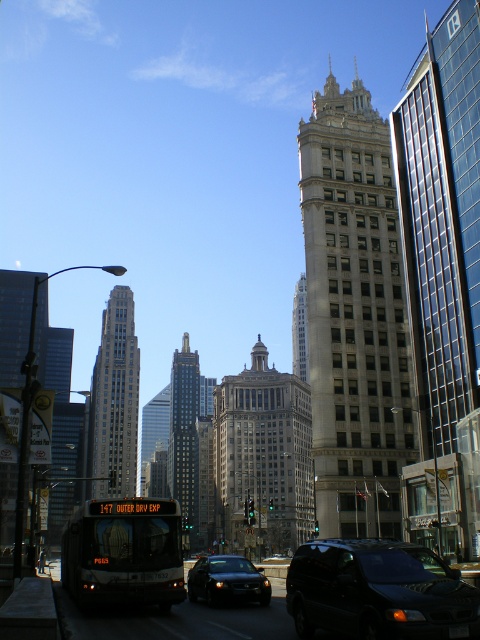
Question: Can you confirm if beige stone building at center is positioned above matte glass skyscraper at left?

Choices:
 (A) yes
 (B) no

Answer: (B)

Question: Which of the following is the farthest from the observer?

Choices:
 (A) (177, 602)
 (B) (191, 374)
 (C) (192, 600)

Answer: (B)

Question: Considering the real-world distances, which object is closest to the matte black bus at lower center?

Choices:
 (A) beige stone building at center
 (B) glassy reflective skyscraper at right

Answer: (B)

Question: Where is glassy reflective skyscraper at right located in relation to matte black bus at lower center in the image?

Choices:
 (A) below
 (B) above

Answer: (B)

Question: Which object is positioned closest to the gray stone skyscraper at center?

Choices:
 (A) glassy reflective skyscraper at right
 (B) shiny black sedan at center
 (C) beige stone building at center
 (D) light beige stone tower at center

Answer: (C)

Question: Is the position of shiny black van at lower right more distant than that of gray stone skyscraper at center?

Choices:
 (A) yes
 (B) no

Answer: (B)